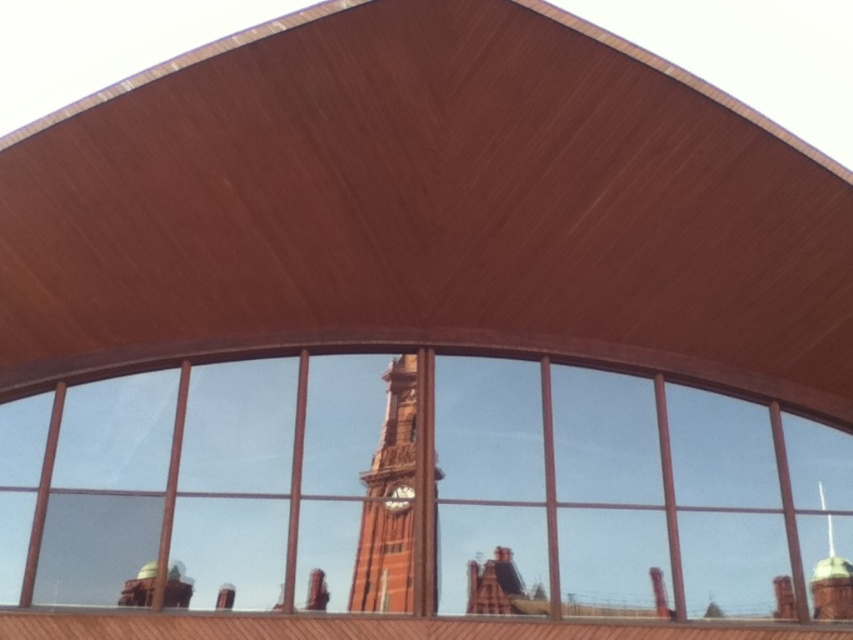
Question: Can you confirm if red brick clock tower at center is positioned to the right of matte brown clock at center?

Choices:
 (A) yes
 (B) no

Answer: (B)

Question: Is clear glass window at center above red brick clock tower at center?

Choices:
 (A) yes
 (B) no

Answer: (B)

Question: Which is nearer to the matte brown clock at center?

Choices:
 (A) red brick clock tower at center
 (B) clear glass window at center

Answer: (A)

Question: Estimate the real-world distances between objects in this image. Which object is closer to the clear glass window at center?

Choices:
 (A) red brick clock tower at center
 (B) matte brown clock at center

Answer: (A)

Question: Considering the real-world distances, which object is closest to the matte brown clock at center?

Choices:
 (A) clear glass window at center
 (B) red brick clock tower at center

Answer: (B)

Question: Does clear glass window at center have a smaller size compared to matte brown clock at center?

Choices:
 (A) yes
 (B) no

Answer: (B)